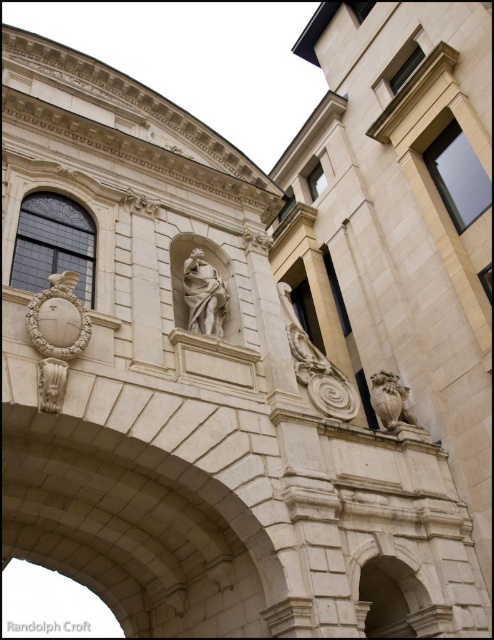
Is white marble statue at center behind matte stone sculpture at lower left?

Yes, white marble statue at center is behind matte stone sculpture at lower left.

Is white marble statue at center positioned before matte stone sculpture at lower left?

No, white marble statue at center is further to the viewer.

Which is in front, point (217, 276) or point (43, 358)?

Point (43, 358)

The image size is (494, 640). I want to click on white marble statue at center, so click(204, 296).

Who is more distant from viewer, (220, 300) or (386, 416)?

The point (386, 416) is behind.

Between white marble statue at center and stone lion at center right, which one is positioned higher?

white marble statue at center

Is point (197, 308) farther from viewer compared to point (377, 371)?

No, it is in front of (377, 371).

You are a GUI agent. You are given a task and a screenshot of the screen. Output one action in this format:
    pyautogui.click(x=<x>, y=<y>)
    Task: Click on the white marble statue at center
    This screenshot has height=640, width=494.
    Given the screenshot: What is the action you would take?
    pyautogui.click(x=204, y=296)

Image resolution: width=494 pixels, height=640 pixels. Describe the element at coordinates (389, 401) in the screenshot. I see `stone lion at center right` at that location.

Does point (381, 420) lie in front of point (40, 406)?

No, it is behind (40, 406).

Is point (405, 408) positioned after point (53, 412)?

Yes, it is behind point (53, 412).

The image size is (494, 640). Identify the location of stone lion at center right. (389, 401).